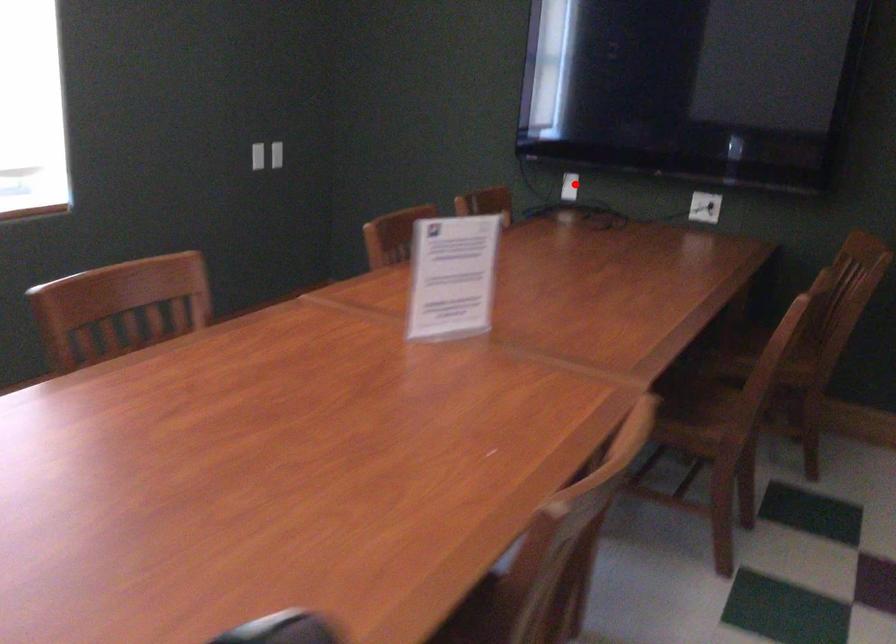
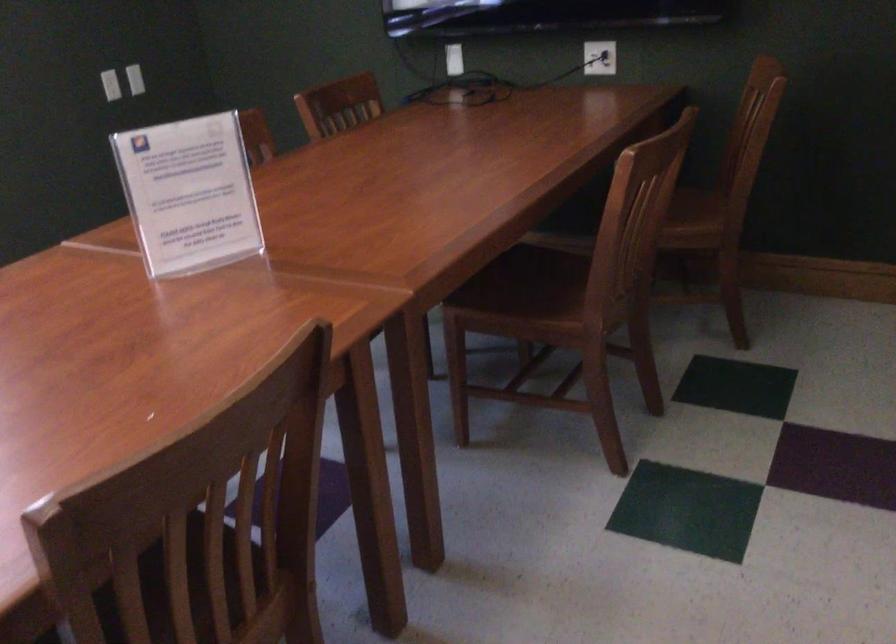
Question: I am providing you with two images of the same scene from different viewpoints. In image1, a red point is highlighted. Considering the same 3D point in image2, which of the following is correct?

Choices:
 (A) It is closer
 (B) It is farther

Answer: (A)